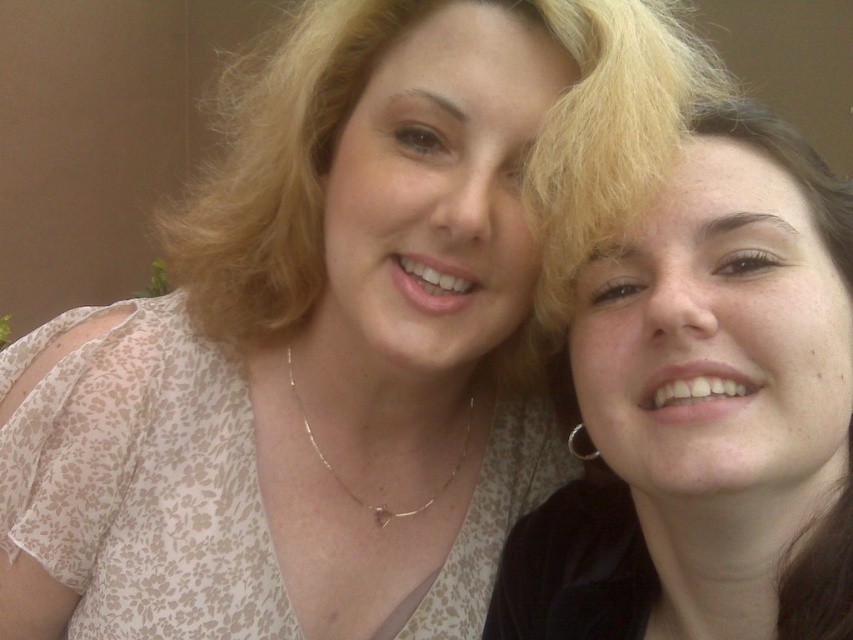
Between matte white blouse at right and silver metallic earring at right, which one appears on the right side from the viewer's perspective?

matte white blouse at right is more to the right.

Between matte white blouse at right and silver metallic earring at right, which one has less height?

silver metallic earring at right

Where is `matte white blouse at right`? This screenshot has width=853, height=640. matte white blouse at right is located at coordinates (706, 413).

Can you confirm if blondehair at center is shorter than silver metallic earring at right?

No, blondehair at center is not shorter than silver metallic earring at right.

Is blondehair at center to the left of silver metallic earring at right from the viewer's perspective?

Yes, blondehair at center is to the left of silver metallic earring at right.

At what (x,y) coordinates should I click in order to perform the action: click on blondehair at center. Please return your answer as a coordinate pair (x, y). This screenshot has width=853, height=640. Looking at the image, I should click on (276, 173).

Describe the element at coordinates (706, 413) in the screenshot. I see `matte white blouse at right` at that location.

Between point (630, 570) and point (346, 0), which one is positioned behind?

Positioned behind is point (346, 0).

Find the location of a particular element. This screenshot has height=640, width=853. matte white blouse at right is located at coordinates (706, 413).